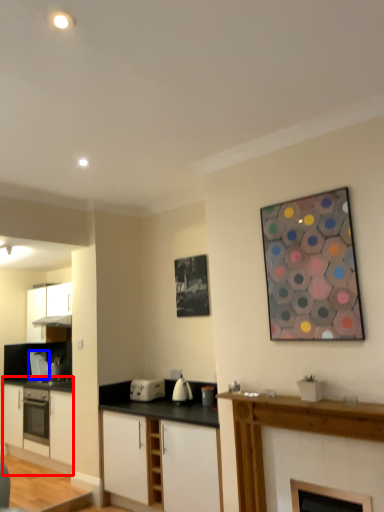
Question: Which object is closer to the camera taking this photo, cabinetry (highlighted by a red box) or appliance (highlighted by a blue box)?

Choices:
 (A) cabinetry
 (B) appliance

Answer: (A)